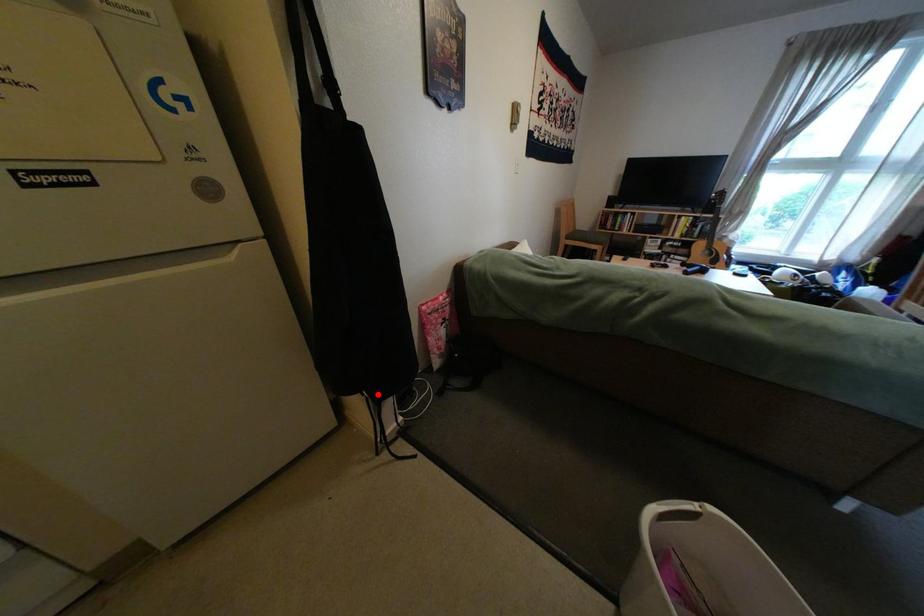
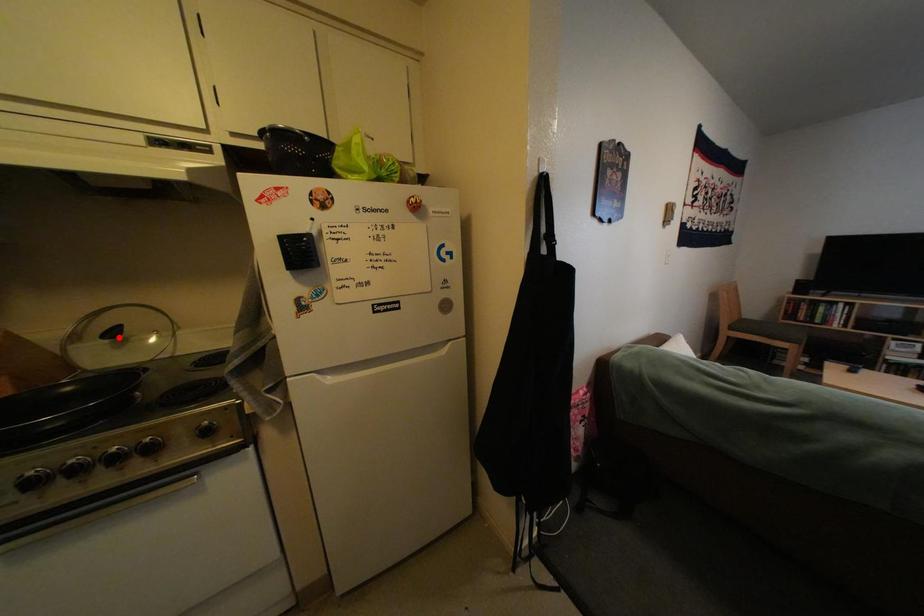
I am providing you with two images of the same scene from different viewpoints. A red point is marked on the first image and another point is marked on the second image. Are the points marked in image1 and image2 representing the same 3D position?

No